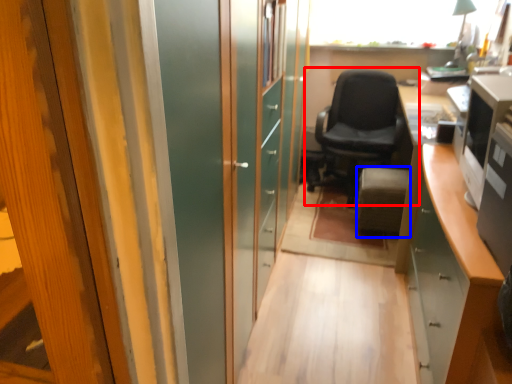
Question: Which object appears farthest to the camera in this image, chair (highlighted by a red box) or furniture (highlighted by a blue box)?

Choices:
 (A) chair
 (B) furniture

Answer: (A)